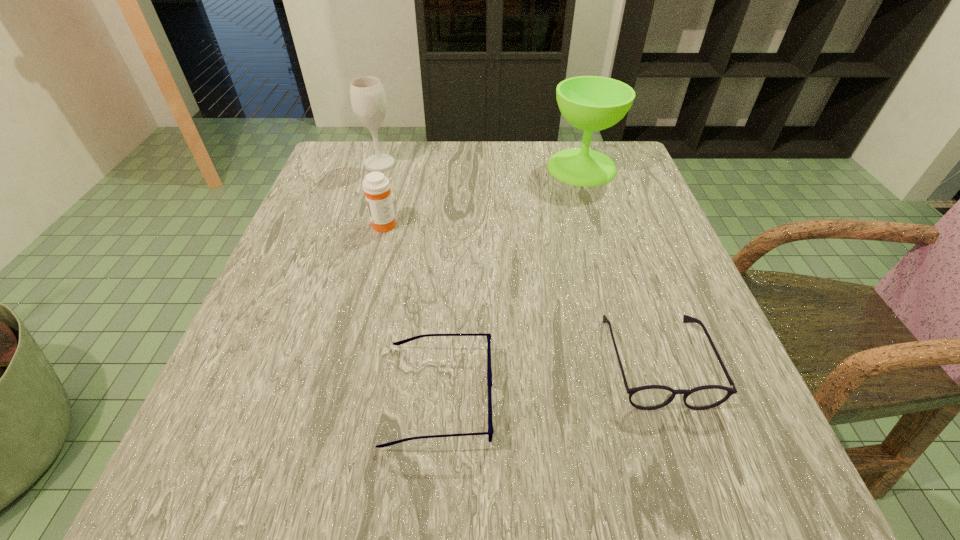
Identify the location of vacant region between the third nearest object and the right wineglass. (x=483, y=196).

Locate an element on the screen. The image size is (960, 540). vacant space that's between the right spectacles and the left wineglass is located at coordinates pos(518,262).

This screenshot has width=960, height=540. Identify the location of empty location between the left spectacles and the left wineglass. (409, 280).

What are the coordinates of `vacant point located between the third nearest object and the right spectacles` in the screenshot? It's located at (520, 292).

Choose which object is the third nearest neighbor to the medicine. Please provide its 2D coordinates. Your answer should be formatted as a tuple, i.e. [(x, y)], where the tuple contains the x and y coordinates of a point satisfying the conditions above.

[(591, 103)]

Identify which object is located as the fourth nearest to the right wineglass. Please provide its 2D coordinates. Your answer should be formatted as a tuple, i.e. [(x, y)], where the tuple contains the x and y coordinates of a point satisfying the conditions above.

[(490, 432)]